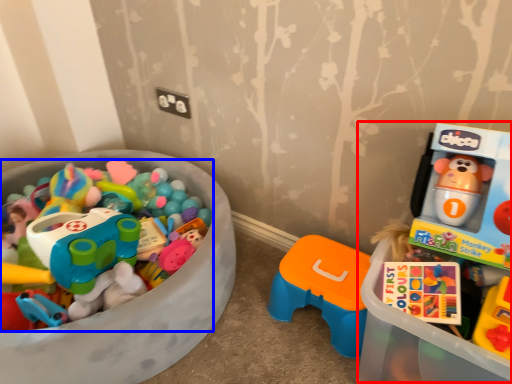
Question: Which point is further to the camera, toyshop (highlighted by a red box) or toy (highlighted by a blue box)?

Choices:
 (A) toyshop
 (B) toy

Answer: (B)